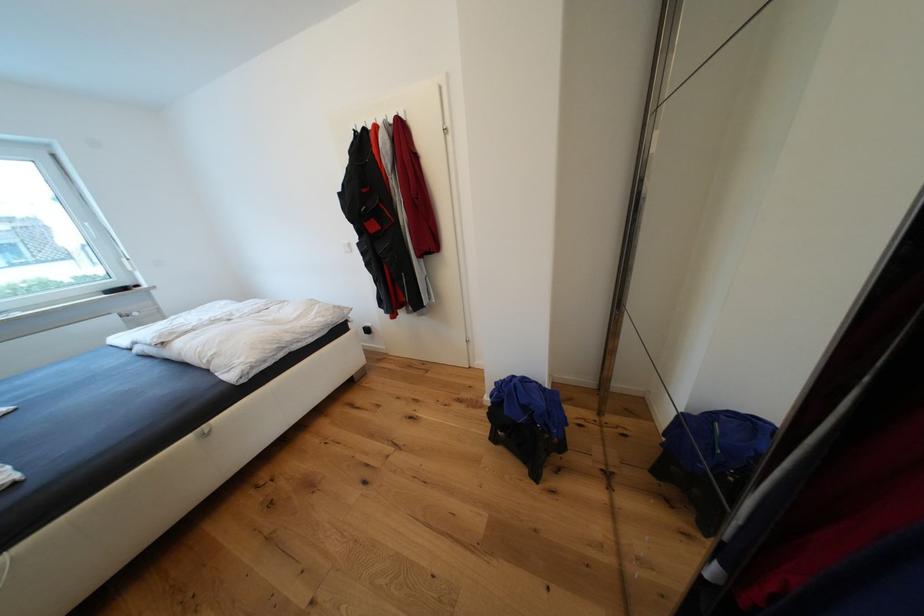
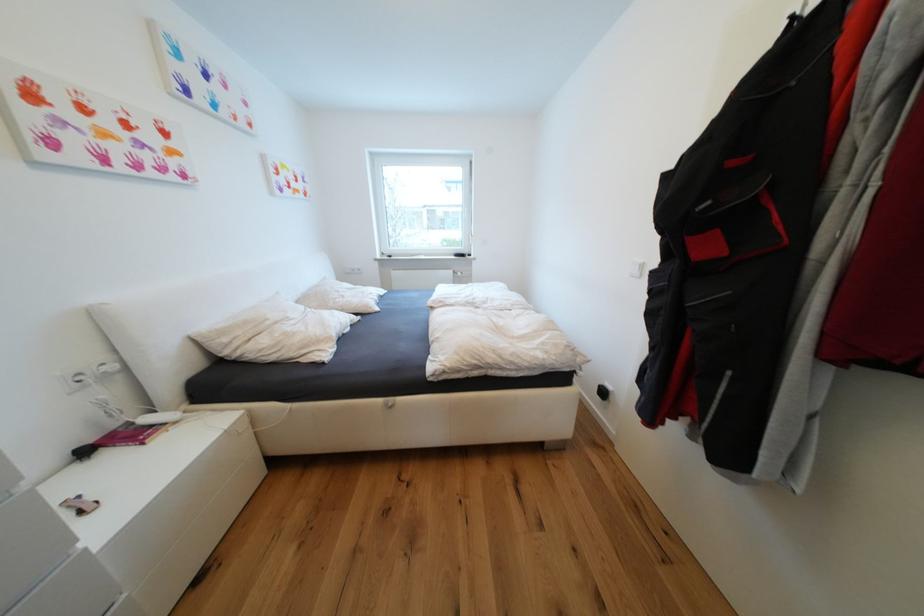
The point at (381, 228) is marked in the first image. Where is the corresponding point in the second image?

(714, 249)